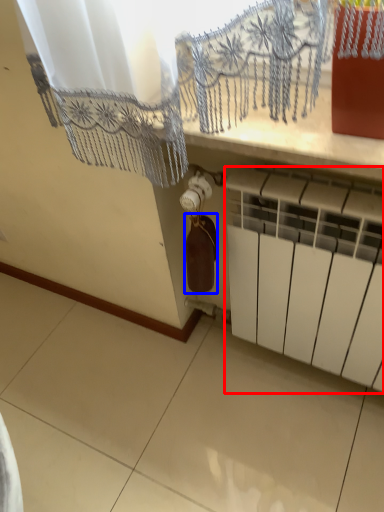
Question: Which object appears farthest to the camera in this image, radiator (highlighted by a red box) or wine bottle (highlighted by a blue box)?

Choices:
 (A) radiator
 (B) wine bottle

Answer: (B)